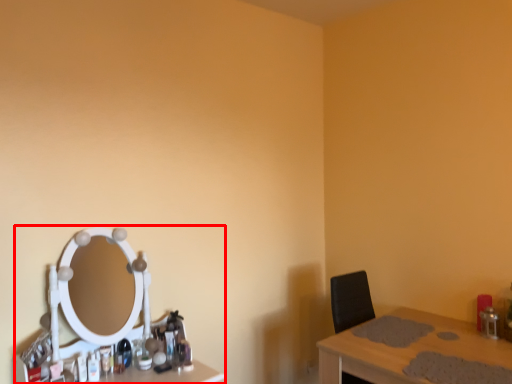
Question: Where is computer desk (annotated by the red box) located in relation to table in the image?

Choices:
 (A) left
 (B) right

Answer: (A)